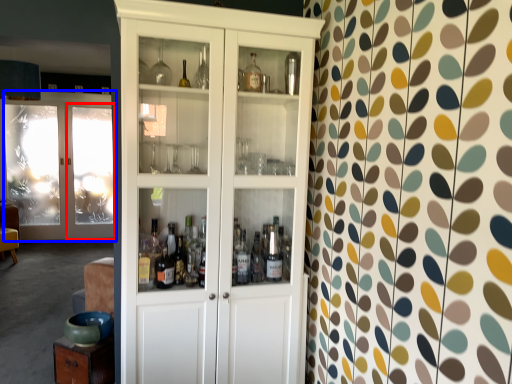
Question: Which point is closer to the camera, screen door (highlighted by a red box) or door (highlighted by a blue box)?

Choices:
 (A) screen door
 (B) door

Answer: (B)